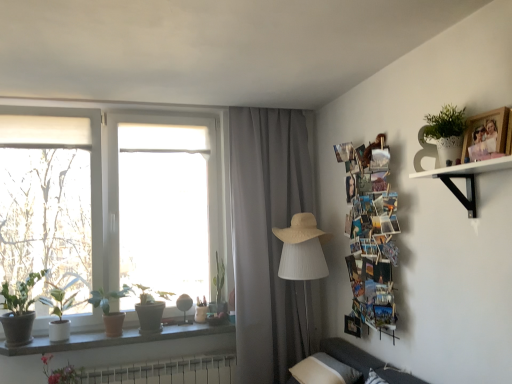
At what (x,y) coordinates should I click in order to perform the action: click on free space above green matte plant at lower left, which ranks as the fifth houseplant in right-to-left order (from a real-world perspective). Please return your answer as a coordinate pair (x, y). The width and height of the screenshot is (512, 384). Looking at the image, I should click on (23, 273).